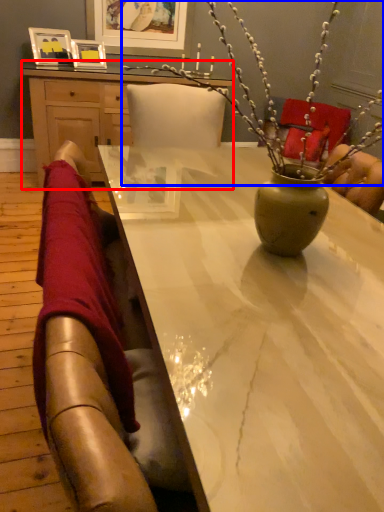
Question: Which of the following is the farthest to the observer, desk (highlighted by a red box) or floral arrangement (highlighted by a blue box)?

Choices:
 (A) desk
 (B) floral arrangement

Answer: (A)